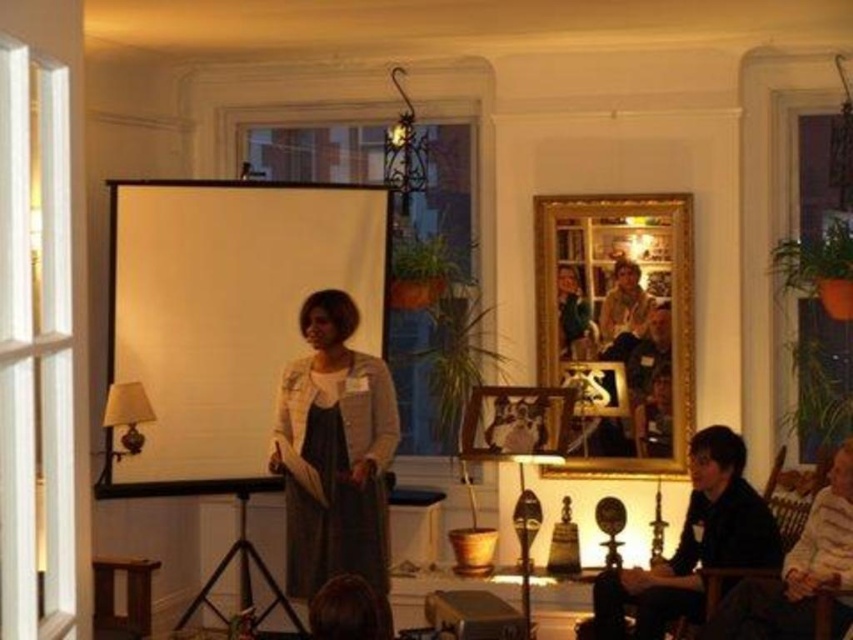
You are organizing a photoshoot in this room and need to place a 1.2 meter wide backdrop behind the objects. Which object between the matte gray sweater at center and the black matte jacket at lower right requires more space horizontally to avoid being cut off?

The black matte jacket at lower right requires more horizontal space because it has a greater width than the matte gray sweater at center, so the backdrop should be placed to accommodate its width of 1.2 meters.

From the picture: You are an observer in the room and want to know which item is higher up in the scene between the matte gray sweater at center and the black matte jacket at lower right. Can you determine this?

The matte gray sweater at center is above the black matte jacket at lower right, so it is higher up in the scene.